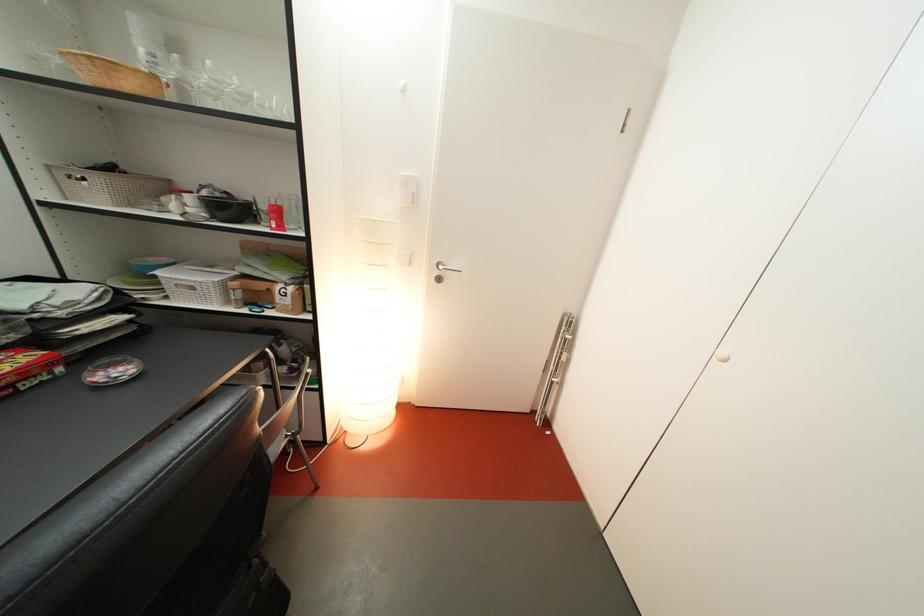
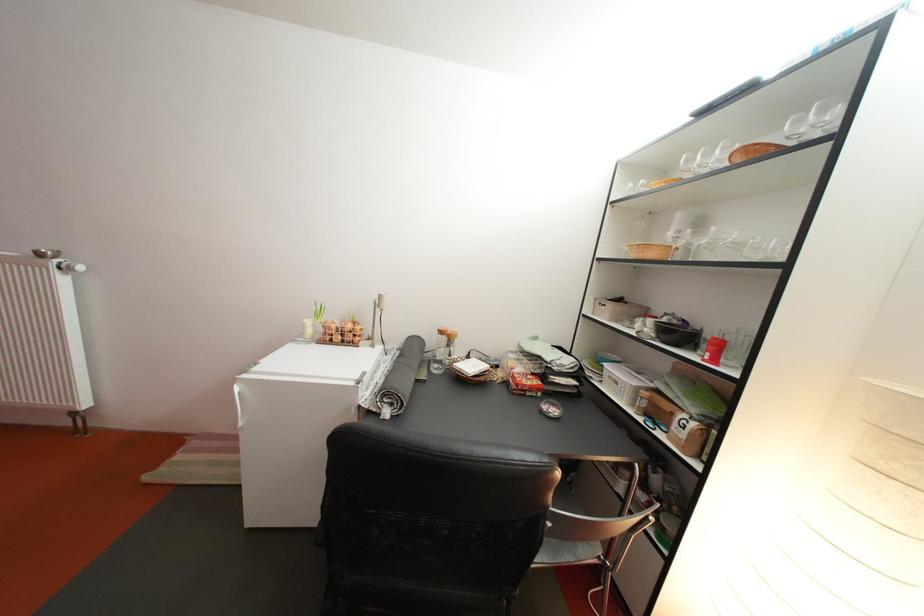
The point at (259,310) is marked in the first image. Where is the corresponding point in the second image?

(658, 421)